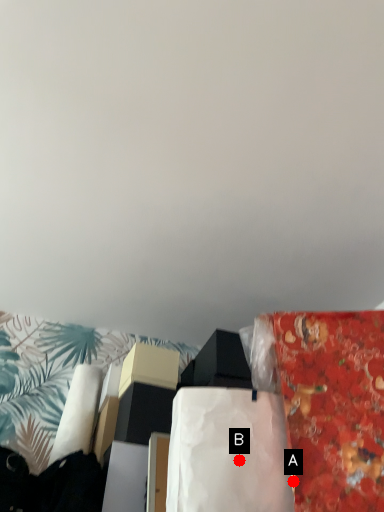
Question: Two points are circled on the image, labeled by A and B beside each circle. Among these points, which one is nearest to the camera?

Choices:
 (A) A is closer
 (B) B is closer

Answer: (A)